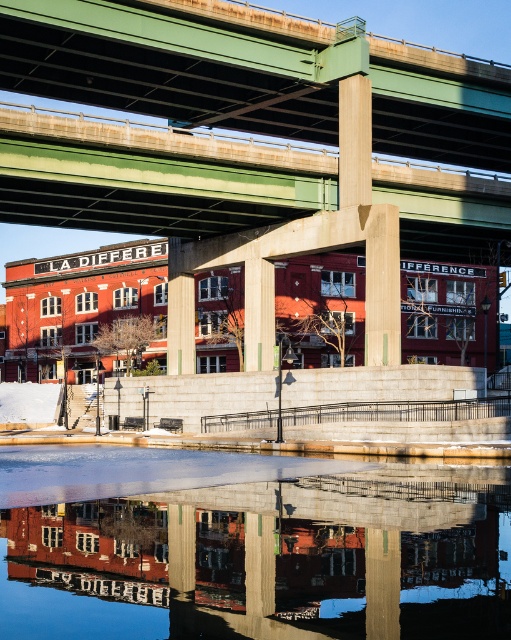
Question: Does transparent glass water at center have a lesser width compared to green concrete bridge at center?

Choices:
 (A) no
 (B) yes

Answer: (B)

Question: Which object is closer to the camera taking this photo?

Choices:
 (A) transparent glass water at center
 (B) green concrete bridge at center

Answer: (A)

Question: Which of the following is the farthest from the observer?

Choices:
 (A) (233, 468)
 (B) (195, 49)

Answer: (B)

Question: Is transparent glass water at center thinner than green concrete bridge at center?

Choices:
 (A) yes
 (B) no

Answer: (A)

Question: Is transparent glass water at center to the left of green concrete bridge at center from the viewer's perspective?

Choices:
 (A) no
 (B) yes

Answer: (B)